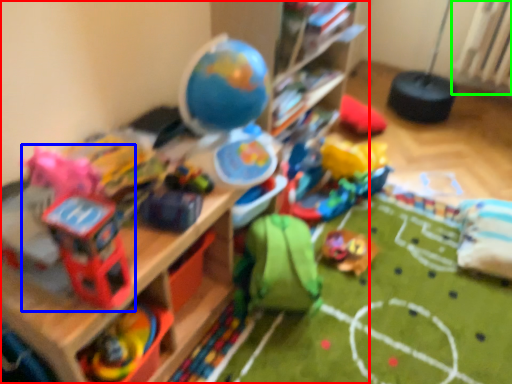
Question: Considering the real-world distances, which object is closest to shelf (highlighted by a red box)? toy (highlighted by a blue box) or radiator (highlighted by a green box).

Choices:
 (A) toy
 (B) radiator

Answer: (A)